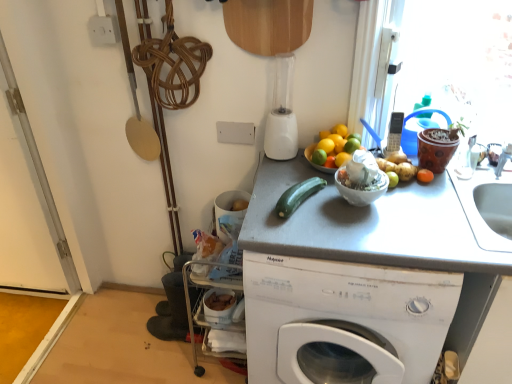
Find the location of `vacant space to the right of green smooth-textured zucchini at center`. vacant space to the right of green smooth-textured zucchini at center is located at coordinates (346, 211).